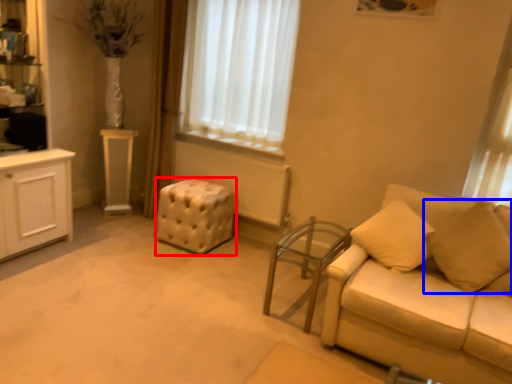
Question: Which object is closer to the camera taking this photo, stool (highlighted by a red box) or pillow (highlighted by a blue box)?

Choices:
 (A) stool
 (B) pillow

Answer: (B)